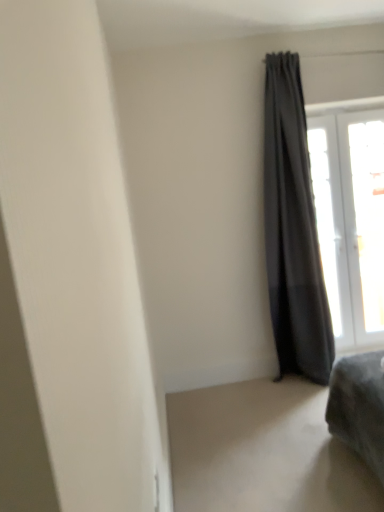
Question: From a real-world perspective, is dark gray fabric curtain at right above or below velvet gray ottoman at lower right?

Choices:
 (A) above
 (B) below

Answer: (A)

Question: Is dark gray fabric curtain at right wider or thinner than velvet gray ottoman at lower right?

Choices:
 (A) wide
 (B) thin

Answer: (B)

Question: Considering the real-world distances, which object is farthest from the velvet gray ottoman at lower right?

Choices:
 (A) dark gray fabric curtain at right
 (B) transparent glass window at upper right, the first window when ordered from left to right
 (C) transparent glass window at upper right, the first window when ordered from right to left

Answer: (C)

Question: Estimate the real-world distances between objects in this image. Which object is farther from the transparent glass window at upper right, which ranks as the 2th window in left-to-right order?

Choices:
 (A) transparent glass window at upper right, the first window when ordered from left to right
 (B) dark gray fabric curtain at right
 (C) velvet gray ottoman at lower right

Answer: (C)